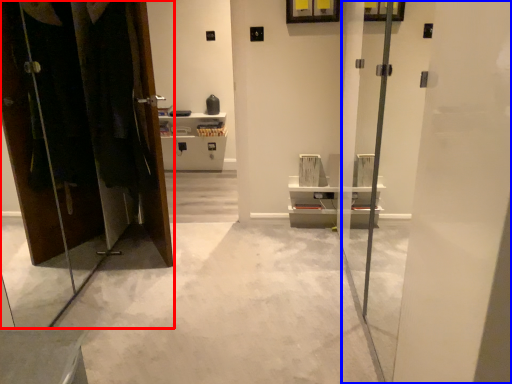
Question: Which point is closer to the camera, dresser (highlighted by a red box) or screen door (highlighted by a blue box)?

Choices:
 (A) dresser
 (B) screen door

Answer: (B)